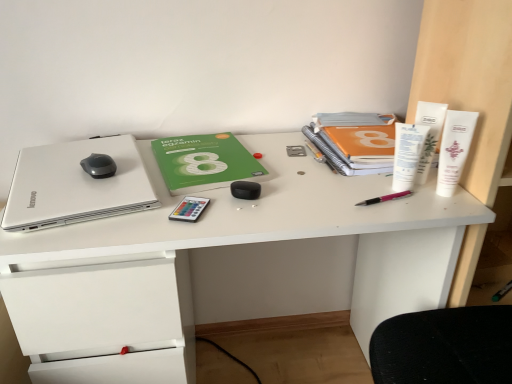
I want to click on free point to the left of white plastic tubes at right, the 3th stationery positioned from the right, so [x=324, y=188].